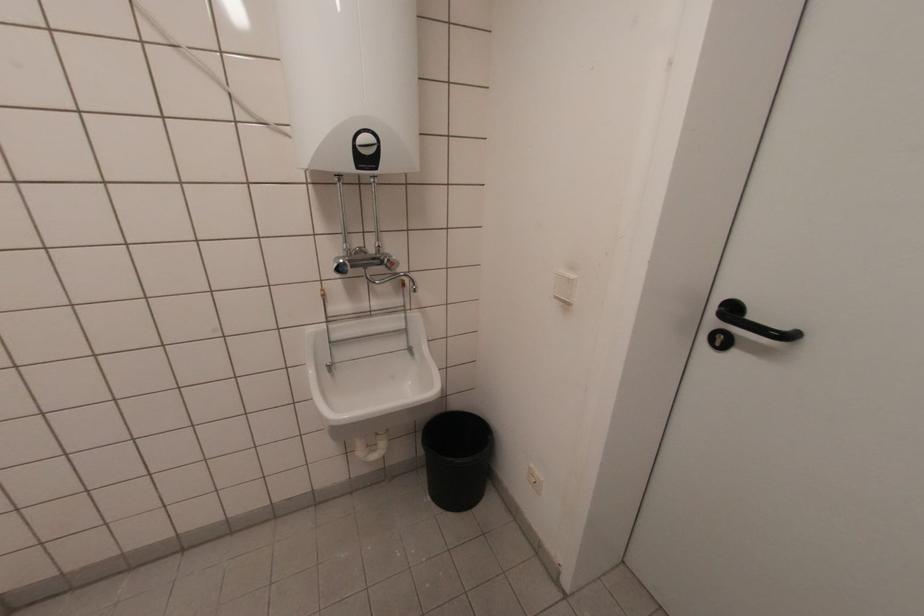
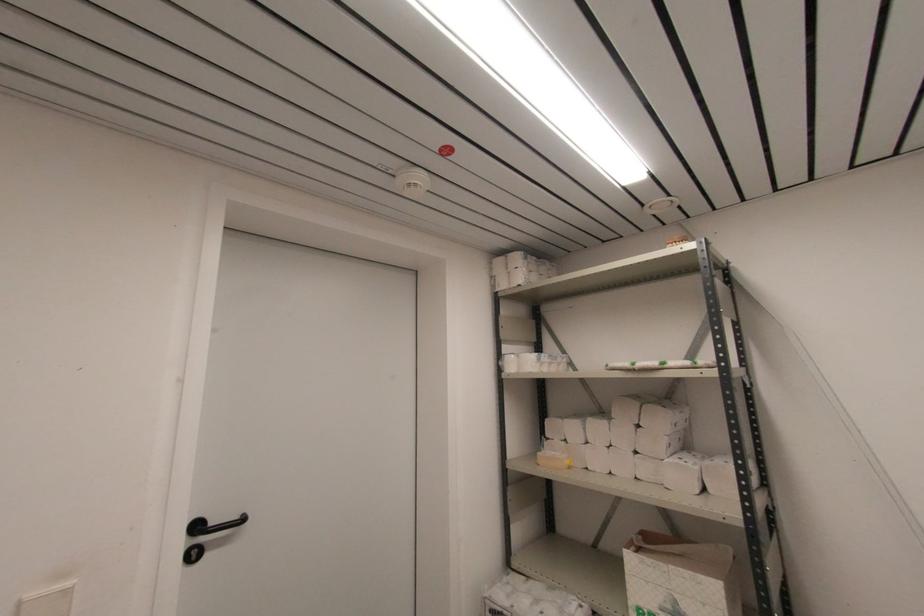
Find the pixel in the second image that matches (x=719, y=344) in the first image.

(196, 557)